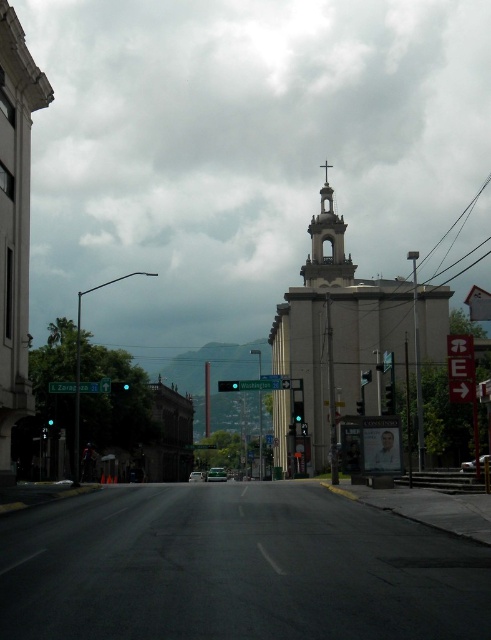
Question: Considering the relative positions of smooth concrete church at center and white stone church at left in the image provided, where is smooth concrete church at center located with respect to white stone church at left?

Choices:
 (A) above
 (B) below

Answer: (B)

Question: Which point is farther from the camera taking this photo?

Choices:
 (A) (323, 264)
 (B) (28, 170)
 (C) (304, 278)

Answer: (C)

Question: Which of the following is the closest to the observer?

Choices:
 (A) white stone church at left
 (B) smooth concrete church at center

Answer: (A)

Question: Is white stone church at left below smooth stone bell tower at center?

Choices:
 (A) yes
 (B) no

Answer: (A)

Question: Among these points, which one is nearest to the camera?

Choices:
 (A) (316, 216)
 (B) (279, 340)

Answer: (B)

Question: Can you confirm if smooth concrete church at center is thinner than white stone church at left?

Choices:
 (A) no
 (B) yes

Answer: (A)